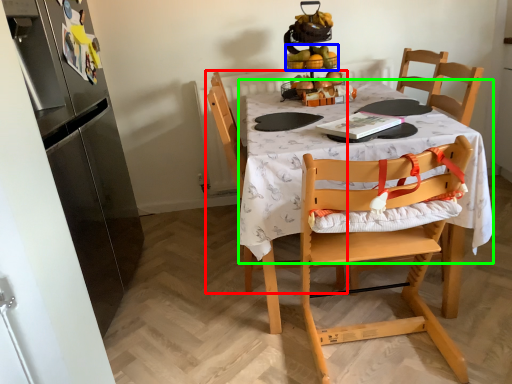
Question: Which object is positioned closest to chair (highlighted by a red box)? Select from fruit (highlighted by a blue box) and round table (highlighted by a green box).

Choices:
 (A) fruit
 (B) round table

Answer: (B)